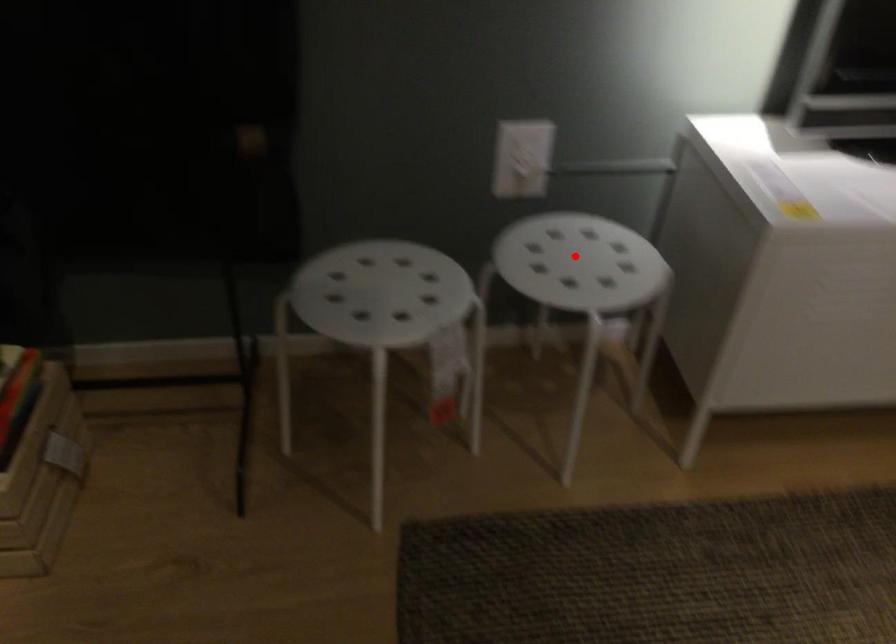
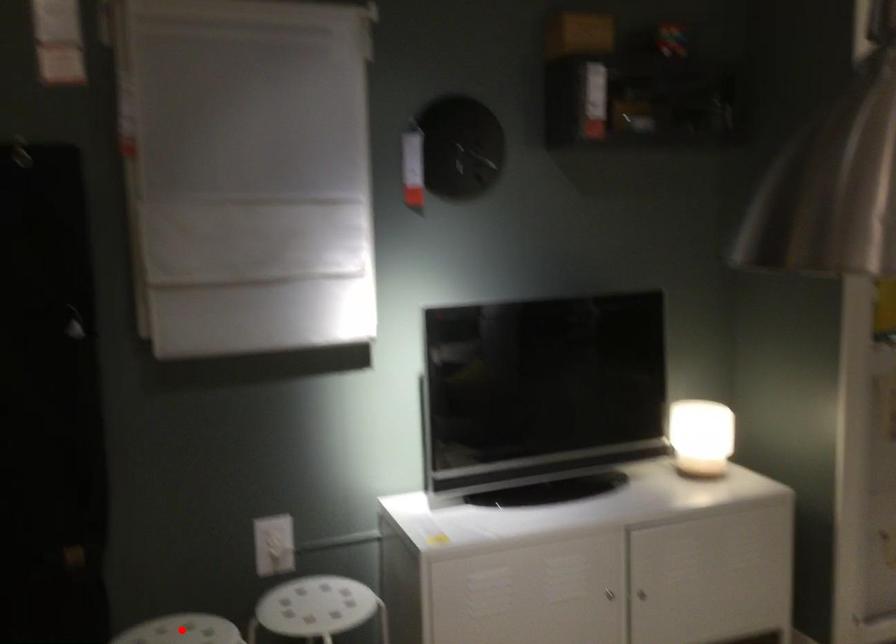
I am providing you with two images of the same scene from different viewpoints. A red point is marked on the first image and another point is marked on the second image. Does the point marked in image1 correspond to the same location as the one in image2?

No